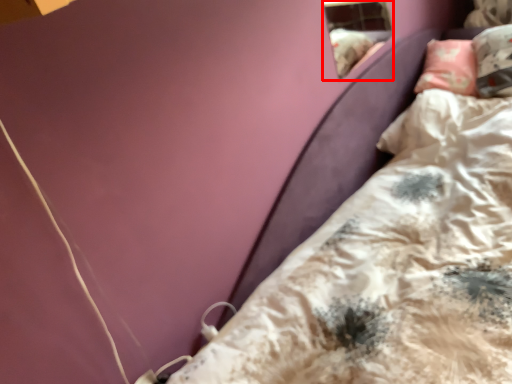
Question: From the image's perspective, where is window (annotated by the red box) located relative to bed?

Choices:
 (A) above
 (B) below

Answer: (A)